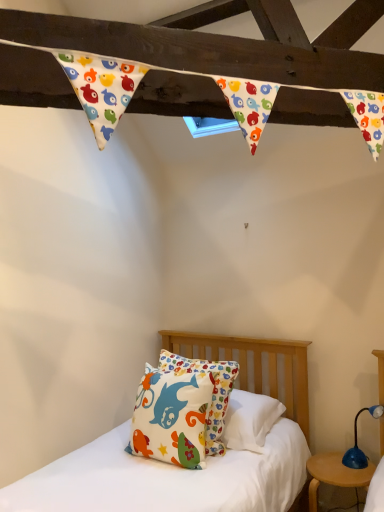
Question: Is matte cotton pillow at center closer to camera compared to blue plastic table lamp at lower right?

Choices:
 (A) yes
 (B) no

Answer: (A)

Question: Can you confirm if matte cotton pillow at center is positioned to the left of blue plastic table lamp at lower right?

Choices:
 (A) yes
 (B) no

Answer: (A)

Question: Does matte cotton pillow at center have a lesser height compared to blue plastic table lamp at lower right?

Choices:
 (A) no
 (B) yes

Answer: (A)

Question: Is matte cotton pillow at center located outside blue plastic table lamp at lower right?

Choices:
 (A) yes
 (B) no

Answer: (A)

Question: Considering the relative sizes of matte cotton pillow at center and blue plastic table lamp at lower right in the image provided, is matte cotton pillow at center wider than blue plastic table lamp at lower right?

Choices:
 (A) yes
 (B) no

Answer: (A)

Question: In terms of size, does wooden round table at lower right appear bigger or smaller than matte cotton pillow at center?

Choices:
 (A) small
 (B) big

Answer: (A)

Question: In the image, is wooden round table at lower right positioned in front of or behind matte cotton pillow at center?

Choices:
 (A) behind
 (B) front

Answer: (A)

Question: From a real-world perspective, is wooden round table at lower right above or below matte cotton pillow at center?

Choices:
 (A) above
 (B) below

Answer: (B)

Question: From the image's perspective, is wooden round table at lower right located above or below matte cotton pillow at center?

Choices:
 (A) above
 (B) below

Answer: (B)

Question: Based on their positions, is matte cotton pillow at center located to the left or right of wooden round table at lower right?

Choices:
 (A) left
 (B) right

Answer: (A)

Question: From the image's perspective, is matte cotton pillow at center above or below wooden round table at lower right?

Choices:
 (A) below
 (B) above

Answer: (B)

Question: Is point (144, 439) closer or farther from the camera than point (345, 480)?

Choices:
 (A) closer
 (B) farther

Answer: (A)

Question: Is matte cotton pillow at center taller or shorter than wooden round table at lower right?

Choices:
 (A) tall
 (B) short

Answer: (A)

Question: Based on their sizes in the image, would you say blue plastic table lamp at lower right is bigger or smaller than matte cotton pillow at center?

Choices:
 (A) big
 (B) small

Answer: (B)

Question: In the image, is blue plastic table lamp at lower right positioned in front of or behind matte cotton pillow at center?

Choices:
 (A) behind
 (B) front

Answer: (A)